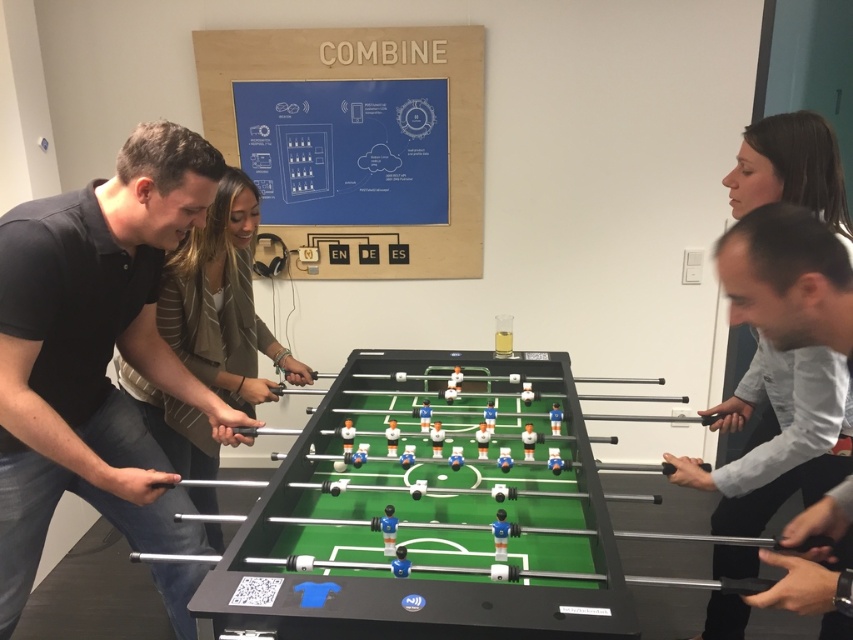
Question: Can you confirm if black shirt at left is positioned to the left of light gray shirt at right?

Choices:
 (A) no
 (B) yes

Answer: (B)

Question: Considering the relative positions of black shirt at left and green plastic foosball table at center in the image provided, where is black shirt at left located with respect to green plastic foosball table at center?

Choices:
 (A) above
 (B) below

Answer: (A)

Question: Is black shirt at left to the right of green plastic foosball table at center from the viewer's perspective?

Choices:
 (A) yes
 (B) no

Answer: (B)

Question: Which point appears closest to the camera in this image?

Choices:
 (A) coord(137,289)
 (B) coord(824,408)

Answer: (B)

Question: Which of the following is the closest to the observer?

Choices:
 (A) green plastic foosball table at center
 (B) black shirt at left
 (C) light gray shirt at right

Answer: (A)

Question: Which point is closer to the camera?

Choices:
 (A) light gray shirt at right
 (B) green plastic foosball table at center

Answer: (B)